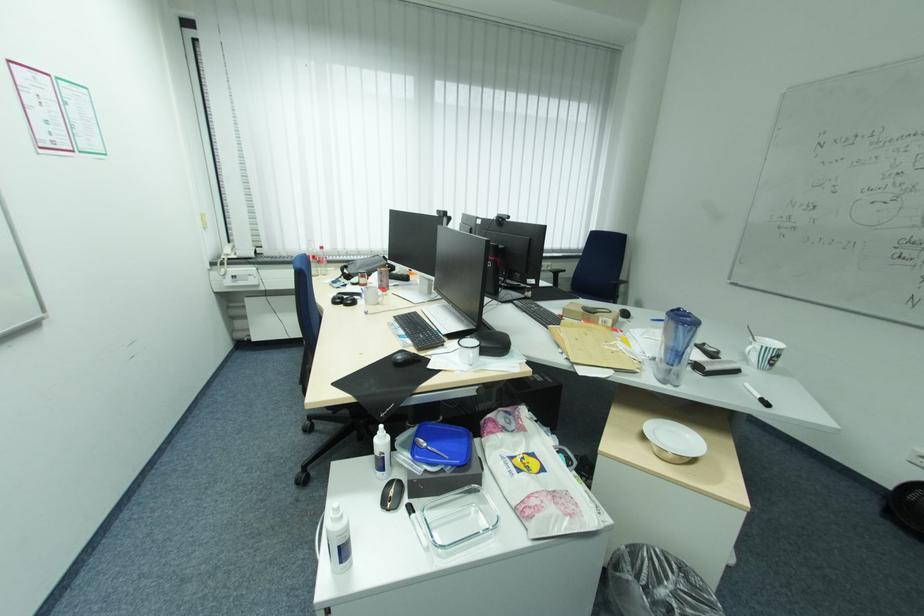
At what (x,y) coordinates should I click in order to perform the action: click on water filter handle. Please return your answer as a coordinate pair (x, y). The height and width of the screenshot is (616, 924). Looking at the image, I should click on (675, 345).